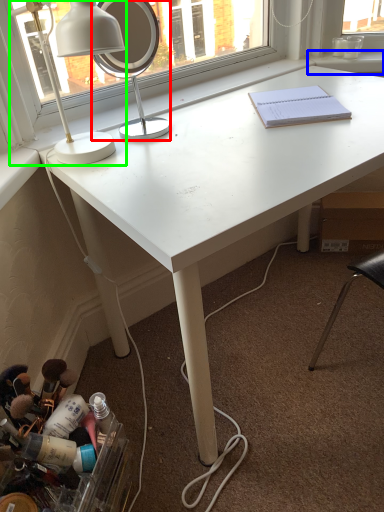
Question: Which object is the farthest from mirror (highlighted by a red box)? Choose among these: window sill (highlighted by a blue box) or lamp (highlighted by a green box).

Choices:
 (A) window sill
 (B) lamp

Answer: (B)